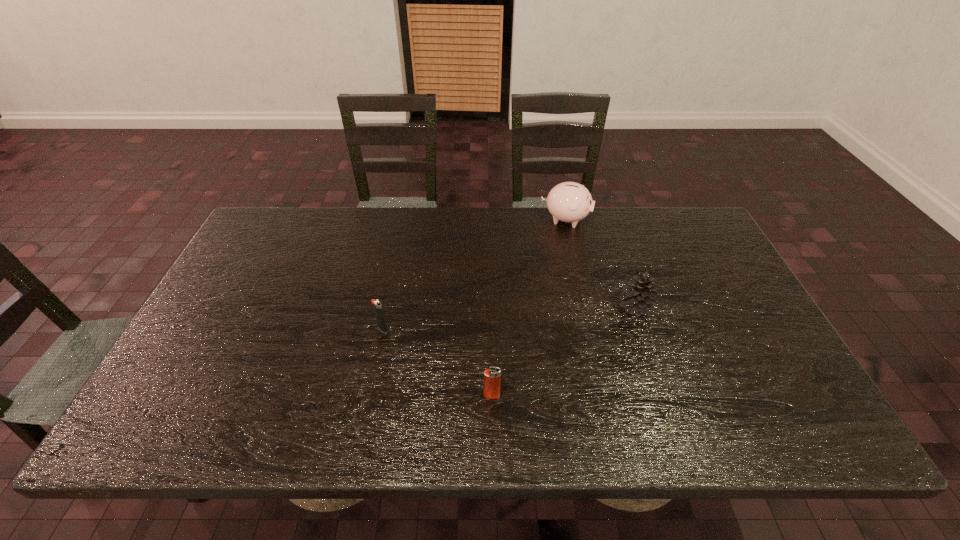
Identify the location of free space that satisfies the following two spatial constraints: 1. on the back side of the right igniter; 2. on the left side of the third nearest object. (490, 307).

Locate an element on the screen. This screenshot has height=540, width=960. vacant space that satisfies the following two spatial constraints: 1. on the back side of the pinecone; 2. on the right side of the leftmost object is located at coordinates (387, 307).

Identify the location of free space that satisfies the following two spatial constraints: 1. on the front side of the second nearest object; 2. on the left side of the nearest object. Image resolution: width=960 pixels, height=540 pixels. (369, 395).

What are the coordinates of `free space that satisfies the following two spatial constraints: 1. on the front side of the piggy bank; 2. on the left side of the pinecone` in the screenshot? It's located at (587, 307).